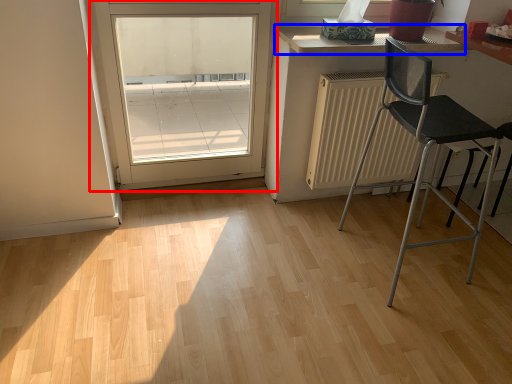
Question: Which point is closer to the camera, door (highlighted by a red box) or counter top (highlighted by a blue box)?

Choices:
 (A) door
 (B) counter top

Answer: (A)